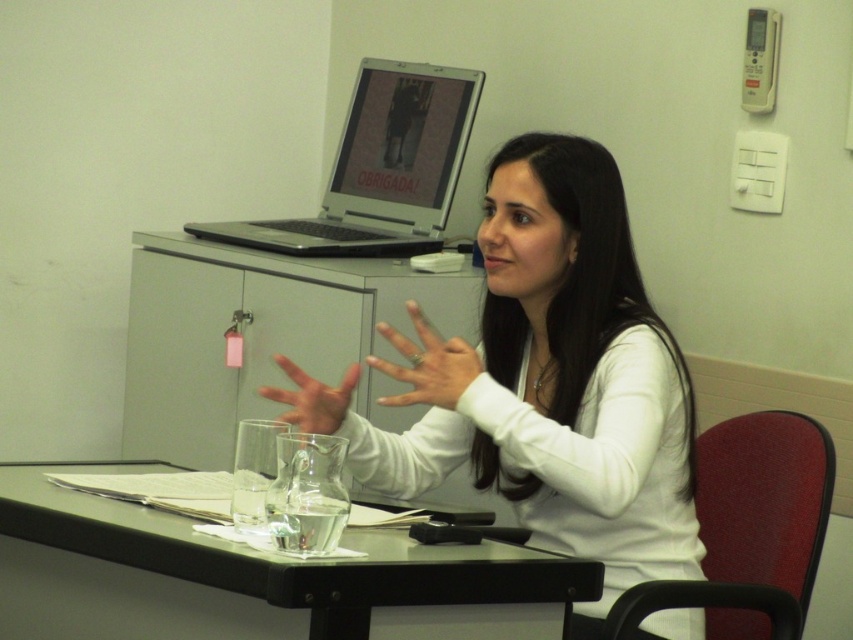
Question: Does silver metallic laptop at upper center have a smaller size compared to white matte hand at center?

Choices:
 (A) no
 (B) yes

Answer: (A)

Question: Among these objects, which one is nearest to the camera?

Choices:
 (A) black plastic table at center
 (B) white matte shirt at center
 (C) translucent glass hand at center

Answer: (A)

Question: Which point appears closest to the camera in this image?

Choices:
 (A) (437, 358)
 (B) (293, 404)
 (C) (47, 588)
 (D) (395, 86)

Answer: (C)

Question: Is black plastic table at center wider than silver metallic laptop at upper center?

Choices:
 (A) no
 (B) yes

Answer: (B)

Question: Which object is farther from the camera taking this photo?

Choices:
 (A) black plastic table at center
 (B) white matte shirt at center
 (C) silver metallic laptop at upper center
 (D) translucent glass hand at center

Answer: (C)

Question: Is white matte hand at center smaller than translucent glass hand at center?

Choices:
 (A) yes
 (B) no

Answer: (B)